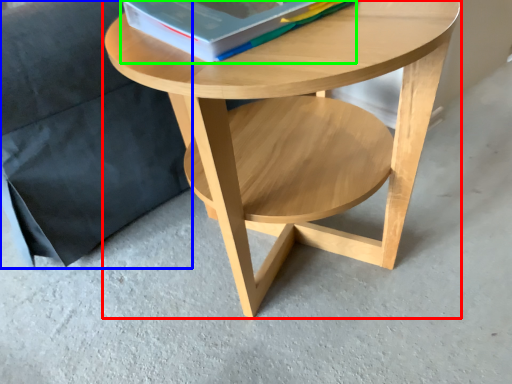
Question: Based on their relative distances, which object is nearer to coffee table (highlighted by a red box)? Choose from armchair (highlighted by a blue box) and paperback book (highlighted by a green box).

Choices:
 (A) armchair
 (B) paperback book

Answer: (B)